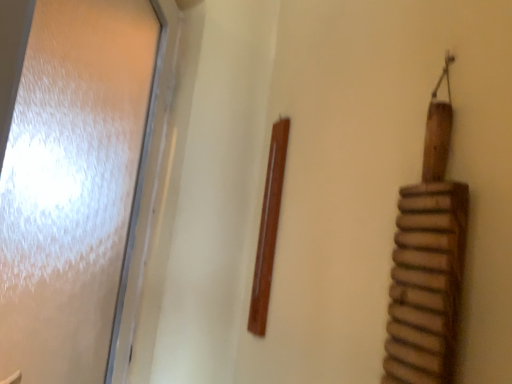
Where is `frosted glass door at left`? This screenshot has width=512, height=384. frosted glass door at left is located at coordinates (74, 183).

What do you see at coordinates (74, 183) in the screenshot?
I see `frosted glass door at left` at bounding box center [74, 183].

This screenshot has height=384, width=512. I want to click on frosted glass door at left, so click(74, 183).